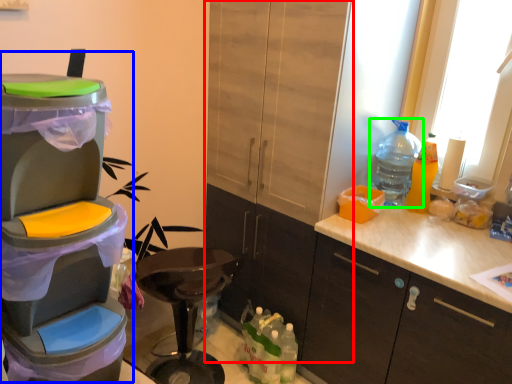
Question: Estimate the real-world distances between objects in this image. Which object is closer to cabinetry (highlighted by a red box), appliance (highlighted by a blue box) or bottle (highlighted by a green box)?

Choices:
 (A) appliance
 (B) bottle

Answer: (B)